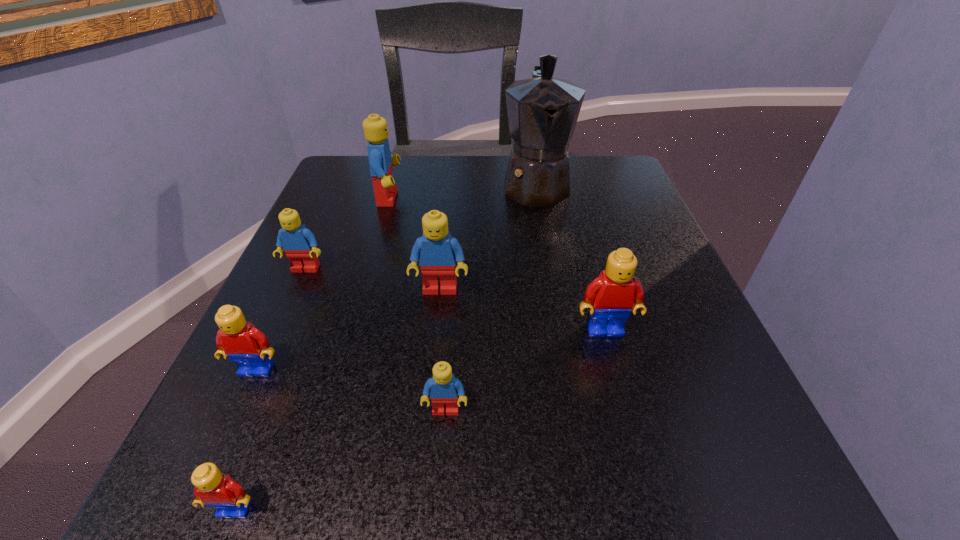
This screenshot has height=540, width=960. Identify the location of vacant point located between the farthest Lego and the smallest blue Lego. (417, 304).

Locate an element on the screen. This screenshot has height=540, width=960. free spot between the nearest blue Lego and the nearest object is located at coordinates (340, 460).

At what (x,y) coordinates should I click in order to perform the action: click on blank region between the third nearest Lego and the third farthest Lego. Please return your answer as a coordinate pair (x, y). This screenshot has height=540, width=960. Looking at the image, I should click on (348, 329).

The height and width of the screenshot is (540, 960). I want to click on vacant area that lies between the second farthest Lego and the third farthest blue Lego, so click(372, 279).

Where is `vacant space that is in between the second nearest yellow Lego and the biggest blue Lego`? The width and height of the screenshot is (960, 540). vacant space that is in between the second nearest yellow Lego and the biggest blue Lego is located at coordinates (323, 284).

I want to click on vacant space that is in between the coffeepot and the biggest yellow Lego, so click(570, 257).

Find the location of `the second closest object to the fifth farthest Lego`. the second closest object to the fifth farthest Lego is located at coordinates (299, 243).

Where is `object that stands as the seventh closest to the sixth nearest Lego`? The image size is (960, 540). object that stands as the seventh closest to the sixth nearest Lego is located at coordinates (610, 297).

Locate which Lego ranks sixth in proximity to the smallest blue Lego. Please provide its 2D coordinates. Your answer should be formatted as a tuple, i.e. [(x, y)], where the tuple contains the x and y coordinates of a point satisfying the conditions above.

[(375, 128)]

Locate an element on the screen. The image size is (960, 540). Lego object that ranks as the third closest to the nearest blue Lego is located at coordinates tap(212, 488).